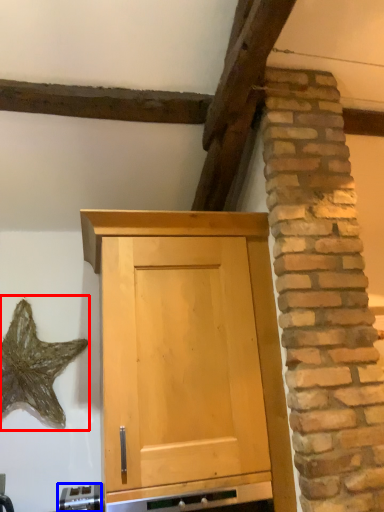
Question: Which object appears farthest to the camera in this image, star (highlighted by a red box) or appliance (highlighted by a blue box)?

Choices:
 (A) star
 (B) appliance

Answer: (A)